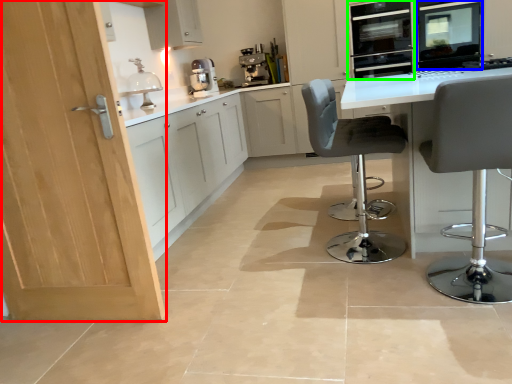
Question: Which is nearer to the door (highlighted by a red box)? appliance (highlighted by a blue box) or oven (highlighted by a green box).

Choices:
 (A) appliance
 (B) oven

Answer: (A)